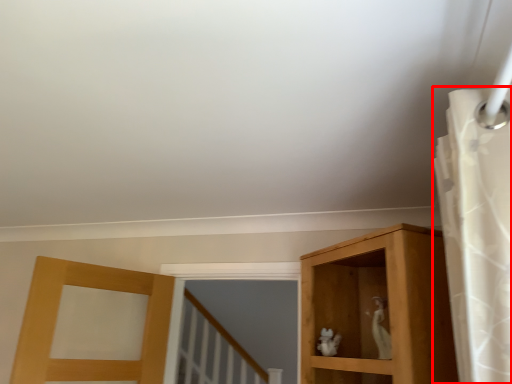
Question: Where is shower curtain (annotated by the red box) located in relation to animal in the image?

Choices:
 (A) right
 (B) left

Answer: (A)